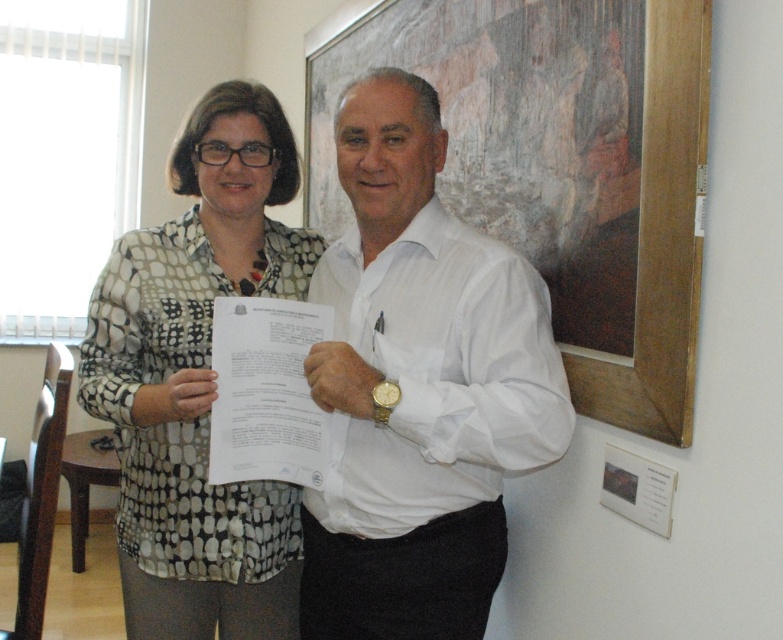
Question: Is white smooth shirt at center thinner than wooden at right?

Choices:
 (A) no
 (B) yes

Answer: (B)

Question: Does white smooth shirt at center have a lesser width compared to polka dot blouse at center?

Choices:
 (A) no
 (B) yes

Answer: (A)

Question: Where is white smooth shirt at center located in relation to polka dot blouse at center in the image?

Choices:
 (A) right
 (B) left

Answer: (A)

Question: Which is nearer to the white smooth shirt at center?

Choices:
 (A) polka dot blouse at center
 (B) wooden at right

Answer: (A)

Question: Which is nearer to the polka dot blouse at center?

Choices:
 (A) wooden at right
 (B) white smooth shirt at center

Answer: (B)

Question: Which of the following is the closest to the observer?

Choices:
 (A) (439, 60)
 (B) (166, 598)
 (C) (370, 408)

Answer: (C)